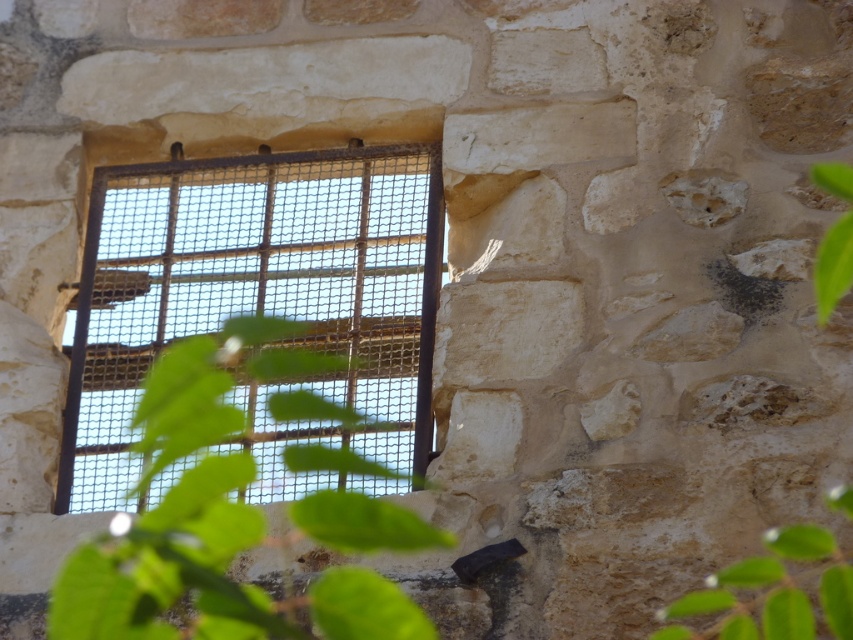
This screenshot has width=853, height=640. I want to click on green leafy plant at center, so click(x=172, y=566).

I want to click on green leafy plant at center, so click(x=172, y=566).

Does rusty metal grid at center have a lesser width compared to green leafy plant at upper right?

In fact, rusty metal grid at center might be wider than green leafy plant at upper right.

Can you confirm if rusty metal grid at center is bigger than green leafy plant at upper right?

Indeed, rusty metal grid at center has a larger size compared to green leafy plant at upper right.

The image size is (853, 640). Find the location of `rusty metal grid at center`. rusty metal grid at center is located at coordinates (260, 305).

Locate an element on the screen. Image resolution: width=853 pixels, height=640 pixels. rusty metal grid at center is located at coordinates (260, 305).

Who is shorter, green leafy plant at lower right or green leafy plant at upper right?

With less height is green leafy plant at upper right.

In the scene shown: Who is higher up, green leafy plant at lower right or green leafy plant at upper right?

green leafy plant at upper right is above.

Identify the location of green leafy plant at lower right. (770, 593).

Identify the location of green leafy plant at lower right. The height and width of the screenshot is (640, 853). (770, 593).